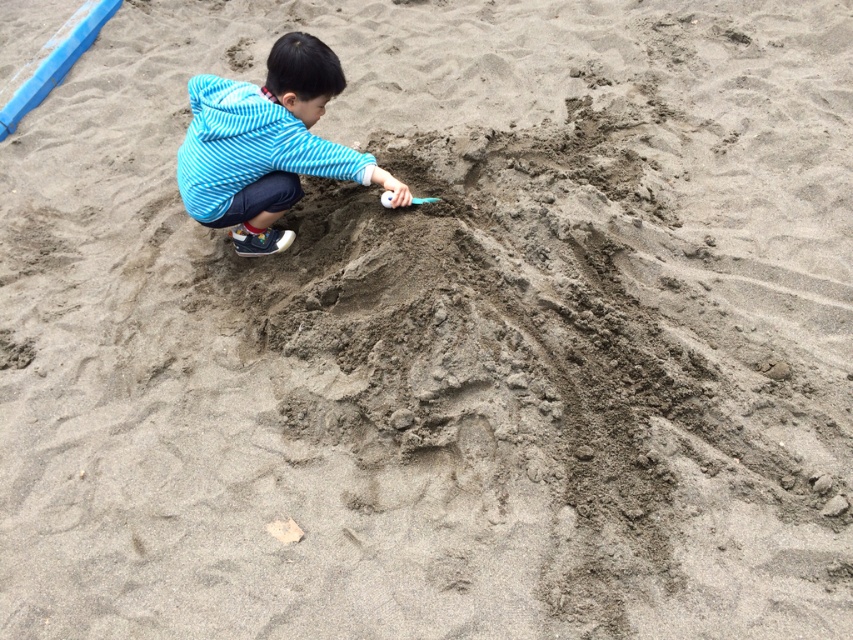
Question: Which point appears closest to the camera in this image?

Choices:
 (A) (386, 205)
 (B) (340, 74)

Answer: (B)

Question: Is blue striped hoodie at upper left thinner than smooth plastic shovel at center?

Choices:
 (A) yes
 (B) no

Answer: (B)

Question: Which point appears farthest from the camera in this image?

Choices:
 (A) (281, 246)
 (B) (387, 192)

Answer: (A)

Question: Does blue striped hoodie at upper left have a lesser width compared to smooth plastic shovel at center?

Choices:
 (A) yes
 (B) no

Answer: (B)

Question: Which point is farther to the camera?

Choices:
 (A) (213, 104)
 (B) (419, 198)

Answer: (B)

Question: Does blue striped hoodie at upper left come in front of smooth plastic shovel at center?

Choices:
 (A) no
 (B) yes

Answer: (B)